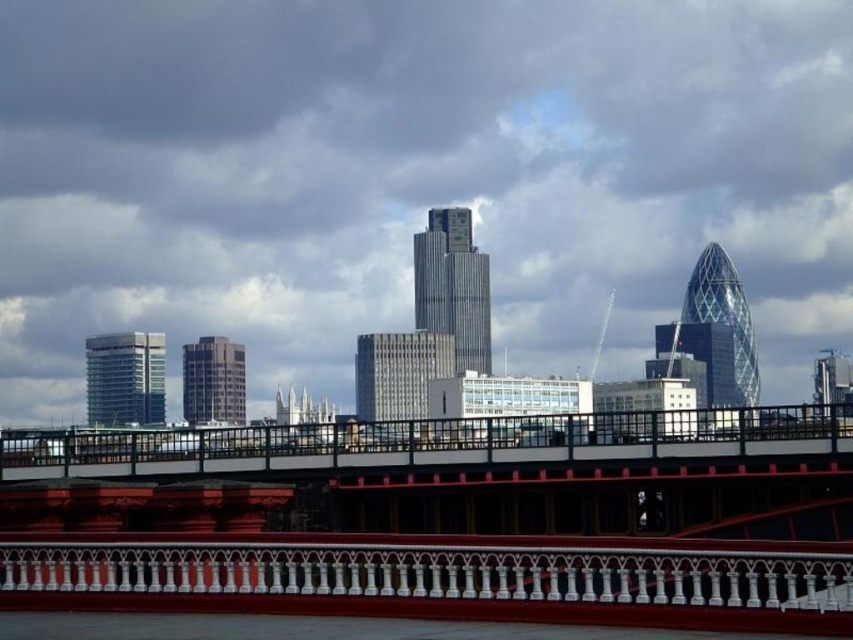
Question: Which point is closer to the camera taking this photo?

Choices:
 (A) (67, 320)
 (B) (772, 602)

Answer: (B)

Question: Which object is closer to the camera taking this photo?

Choices:
 (A) metallic red pedestrian bridge at center
 (B) transparent glass bridge at center

Answer: (A)

Question: Can you confirm if transparent glass bridge at center is positioned above metallic red pedestrian bridge at center?

Choices:
 (A) no
 (B) yes

Answer: (B)

Question: Can you confirm if transparent glass bridge at center is bigger than metallic red pedestrian bridge at center?

Choices:
 (A) no
 (B) yes

Answer: (B)

Question: Does transparent glass bridge at center come in front of metallic red pedestrian bridge at center?

Choices:
 (A) yes
 (B) no

Answer: (B)